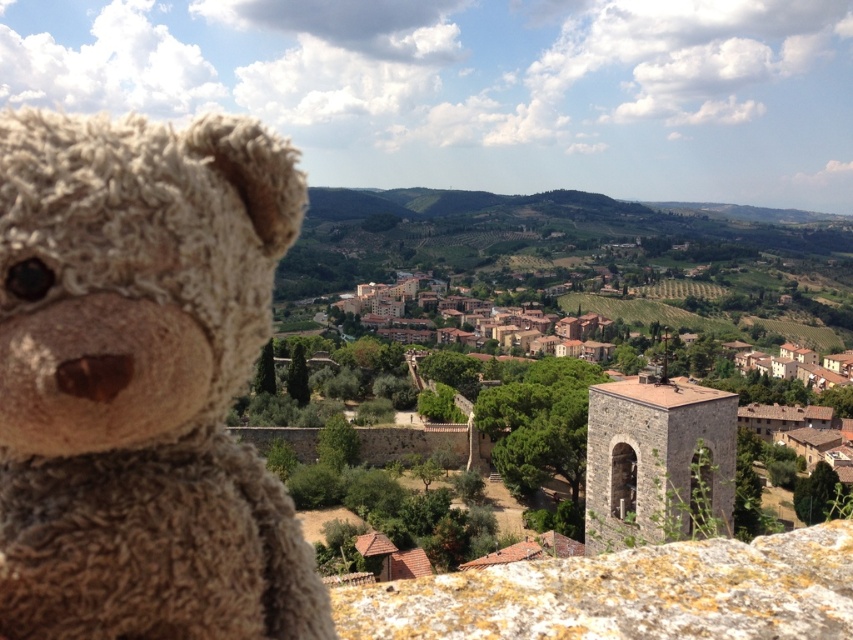
Measure the distance between point (178, 180) and camera.

The distance of point (178, 180) from camera is 26.25 meters.

Is point (260, 586) farther from camera compared to point (469, 582)?

No, it is not.

Is point (6, 413) positioned in front of point (450, 630)?

Yes.

The height and width of the screenshot is (640, 853). I want to click on fuzzy beige teddy bear at left, so click(x=141, y=381).